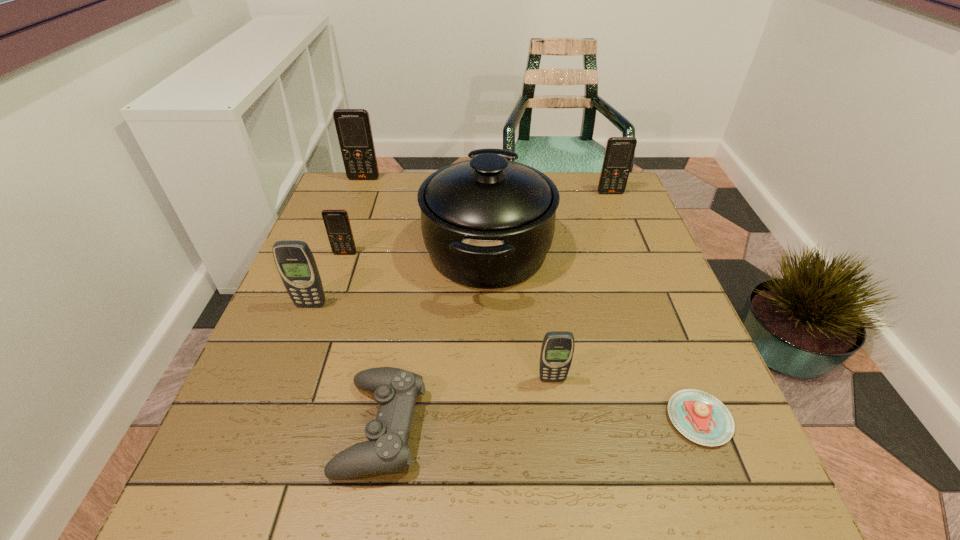
I want to click on vacant region at the left edge, so click(272, 416).

This screenshot has height=540, width=960. In order to click on vacant region at the right edge of the desktop in this screenshot , I will do `click(616, 241)`.

Where is `vacant space at the far left corner`? This screenshot has height=540, width=960. vacant space at the far left corner is located at coordinates (376, 197).

The height and width of the screenshot is (540, 960). In the image, there is a desktop. What are the coordinates of `blank space at the near left corner` in the screenshot? It's located at (220, 486).

Identify the location of vacant space at the near right corner. Image resolution: width=960 pixels, height=540 pixels. click(724, 478).

Find the location of a particular element. This screenshot has width=960, height=540. free space that is in between the saucepan and the bigger gray cellular telephone is located at coordinates (399, 277).

Identify the location of vacant space in between the control and the second smallest orange cellular telephone. (495, 310).

You are a GUI agent. You are given a task and a screenshot of the screen. Output one action in this format:
    pyautogui.click(x=<x>, y=<y>)
    Task: Click on the free point between the third nearest cellular telephone and the shortest object
    
    Given the screenshot: What is the action you would take?
    pyautogui.click(x=522, y=336)

Find the location of a particular element. The height and width of the screenshot is (540, 960). blank region between the fourth cellular telephone from left to right and the black saucepan is located at coordinates 519,314.

Locate an element on the screen. The width and height of the screenshot is (960, 540). free space between the shortest object and the tallest cellular telephone is located at coordinates (532, 299).